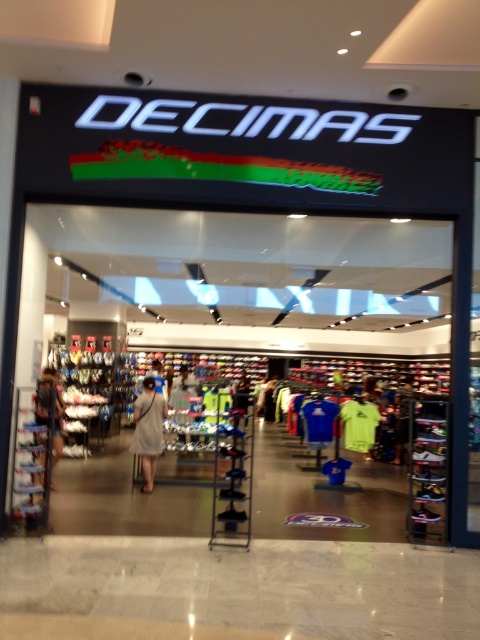
Question: Based on their relative distances, which object is nearer to the light gray fabric shirt at center?

Choices:
 (A) light gray fabric dress at left
 (B) light beige fabric dress at center

Answer: (B)

Question: Which of these objects is positioned closest to the light gray fabric shirt at center?

Choices:
 (A) light gray fabric dress at left
 (B) light beige fabric dress at center

Answer: (B)

Question: Does light gray fabric dress at left appear on the left side of light gray fabric shirt at center?

Choices:
 (A) yes
 (B) no

Answer: (A)

Question: Does light gray fabric dress at left appear under light gray fabric shirt at center?

Choices:
 (A) no
 (B) yes

Answer: (A)

Question: Which of the following is the closest to the observer?

Choices:
 (A) (141, 419)
 (B) (400, 426)

Answer: (A)

Question: Can you confirm if light beige fabric dress at center is wider than light gray fabric shirt at center?

Choices:
 (A) yes
 (B) no

Answer: (B)